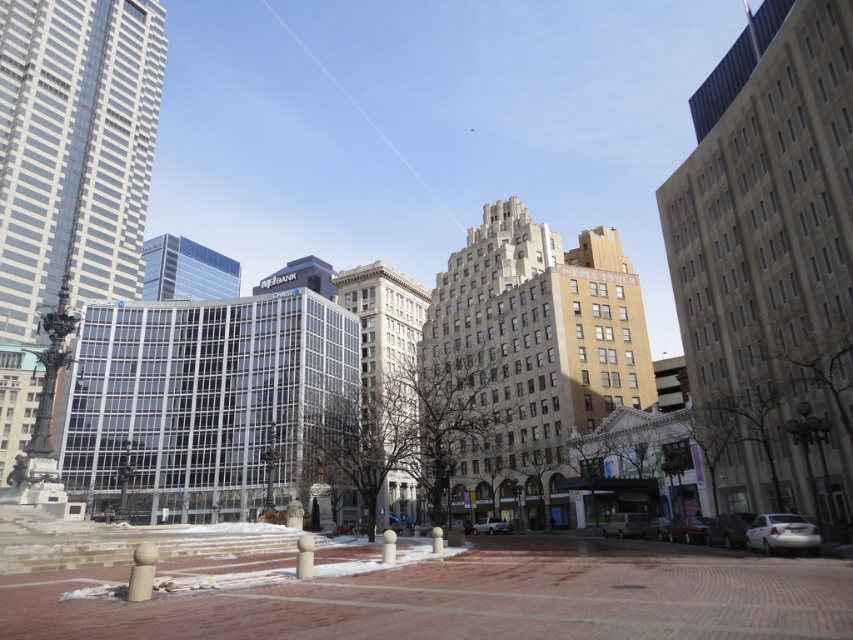
Question: Is metallic silver van at lower right wider than white matte truck at center?

Choices:
 (A) yes
 (B) no

Answer: (A)

Question: Is clear glass skyscraper at center to the left of white matte truck at center from the viewer's perspective?

Choices:
 (A) no
 (B) yes

Answer: (B)

Question: Which point is farther to the camera?

Choices:
 (A) shiny silver sedan at lower right
 (B) beige stone building at center

Answer: (B)

Question: From the image, what is the correct spatial relationship of shiny silver sedan at lower right in relation to white matte truck at center?

Choices:
 (A) above
 (B) below

Answer: (A)

Question: Which point is farther to the camera?

Choices:
 (A) (154, 273)
 (B) (709, 522)

Answer: (A)

Question: Which point is farther to the camera?

Choices:
 (A) (404, 316)
 (B) (200, 284)
 (C) (700, 528)

Answer: (B)